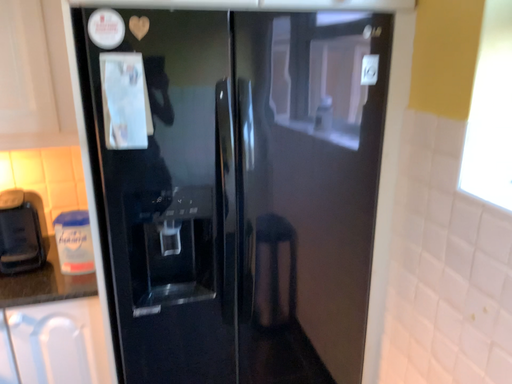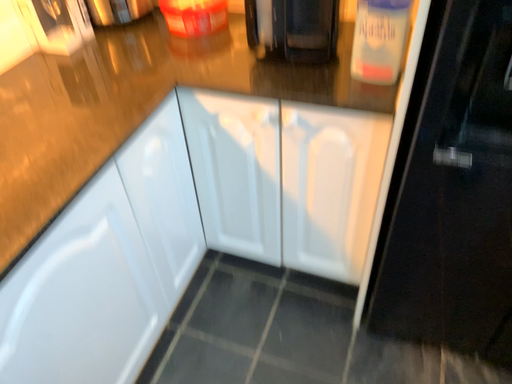
Question: How did the camera likely rotate when shooting the video?

Choices:
 (A) rotated right
 (B) rotated left

Answer: (B)